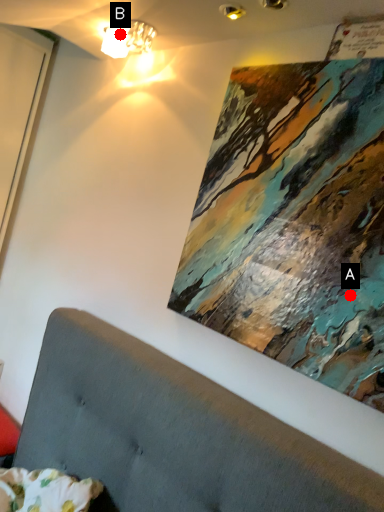
Question: Two points are circled on the image, labeled by A and B beside each circle. Which point is further to the camera?

Choices:
 (A) A is further
 (B) B is further

Answer: (B)